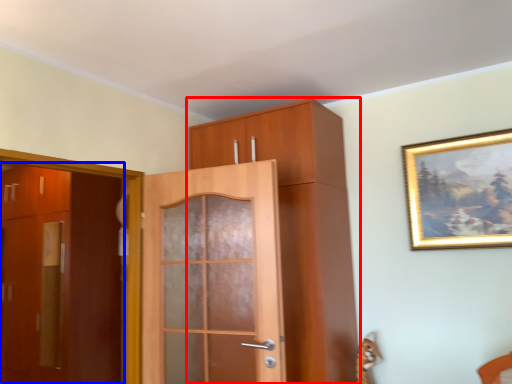
Question: Which object is closer to the camera taking this photo, cabinetry (highlighted by a red box) or door (highlighted by a blue box)?

Choices:
 (A) cabinetry
 (B) door

Answer: (A)